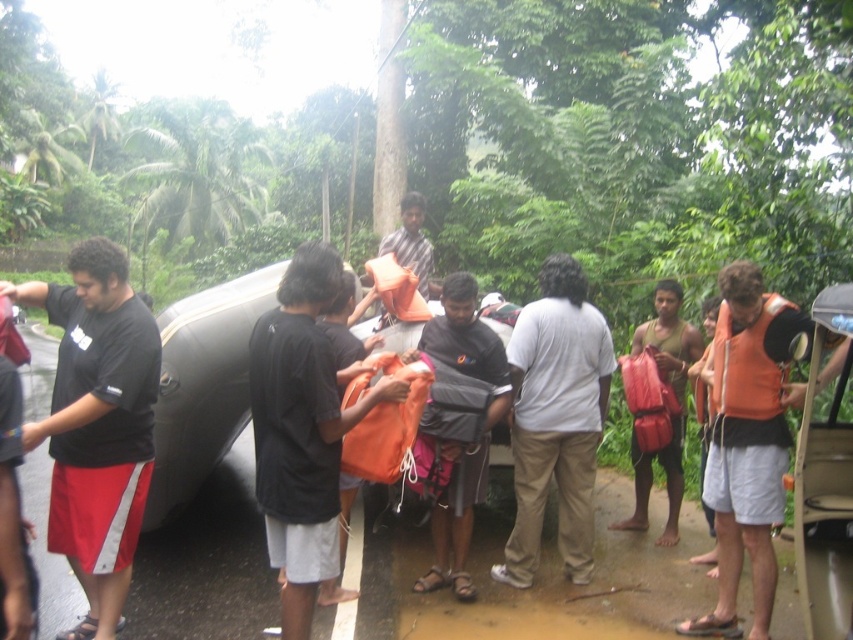
Question: Which is nearer to the orange life vest at right?

Choices:
 (A) dark gray fabric bag at center
 (B) orange fabric bag at center
 (C) black fabric shirt at left
 (D) white matte shirt at center

Answer: (D)

Question: Which object is farther from the camera taking this photo?

Choices:
 (A) white matte shirt at center
 (B) orange fabric bag at center

Answer: (A)

Question: Is black fabric shirt at left wider than orange life vest at right?

Choices:
 (A) no
 (B) yes

Answer: (B)

Question: Which point is farther to the camera?

Choices:
 (A) dark gray fabric bag at center
 (B) orange fabric bag at center
 (C) orange life vest at right

Answer: (A)

Question: Is black fabric shirt at left wider than orange fabric bag at center?

Choices:
 (A) no
 (B) yes

Answer: (B)

Question: Is orange fabric bag at center smaller than white matte shirt at center?

Choices:
 (A) no
 (B) yes

Answer: (A)